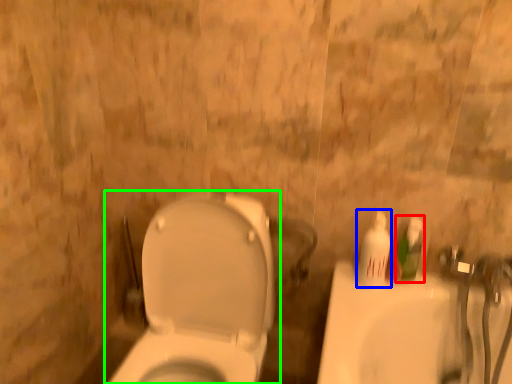
Question: Considering the real-world distances, which object is farthest from mouthwash (highlighted by a red box)? mouthwash (highlighted by a blue box) or toilet (highlighted by a green box)?

Choices:
 (A) mouthwash
 (B) toilet

Answer: (B)